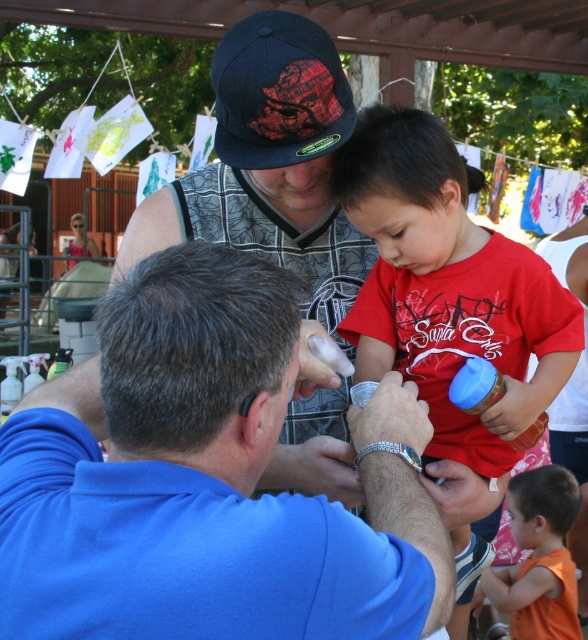
You are standing at the point labeled point [345,269] and want to move to the point labeled point [569,506]. Which direction should you move to get closer to your destination?

You should move away from the camera because point [569,506] is further from the camera than point [345,269].

Based on the photo, what is located at the point with coordinates (447,288)?

The point at coordinates (447,288) has a matte red shirt at center.